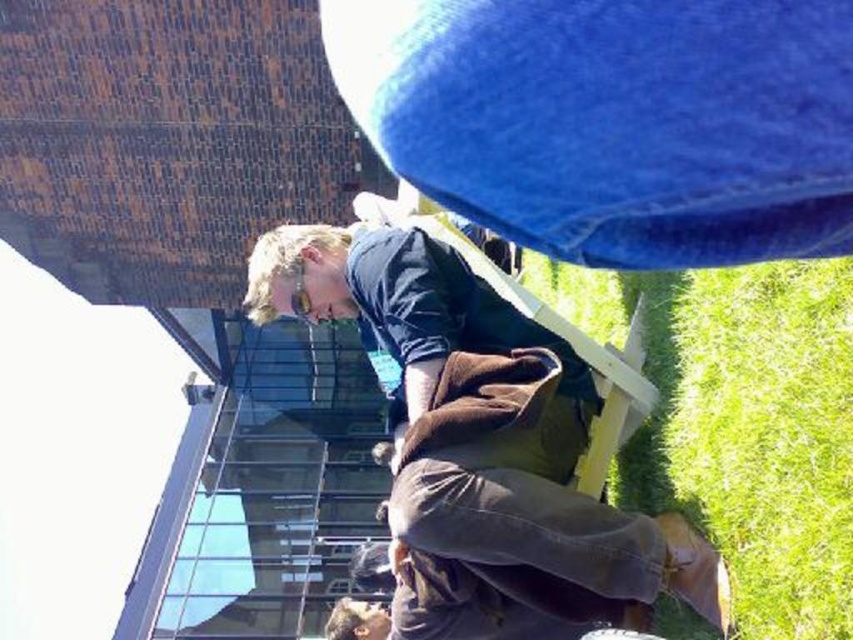
Question: Is the position of brown cotton squat at center more distant than that of green grass at lower right?

Choices:
 (A) yes
 (B) no

Answer: (B)

Question: Observing the image, what is the correct spatial positioning of brown cotton squat at center in reference to green grass at lower right?

Choices:
 (A) left
 (B) right

Answer: (A)

Question: Is brown cotton squat at center smaller than green grass at lower right?

Choices:
 (A) no
 (B) yes

Answer: (A)